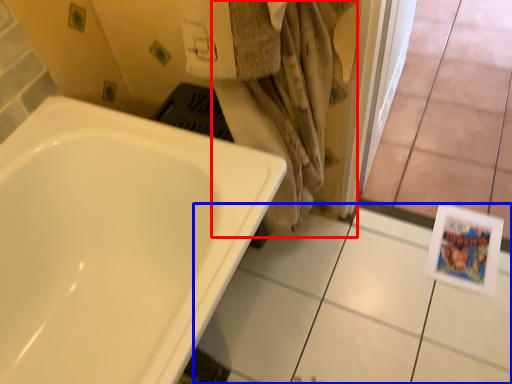
Question: Which point is closer to the camera, bath towel (highlighted by a red box) or ceramic tile (highlighted by a blue box)?

Choices:
 (A) bath towel
 (B) ceramic tile

Answer: (A)